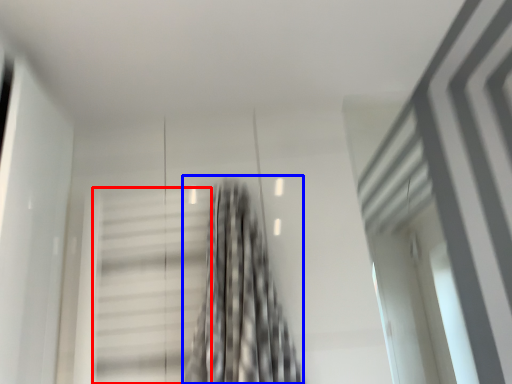
Question: Which point is closer to the camera, stairs (highlighted by a red box) or curtain (highlighted by a blue box)?

Choices:
 (A) stairs
 (B) curtain

Answer: (B)